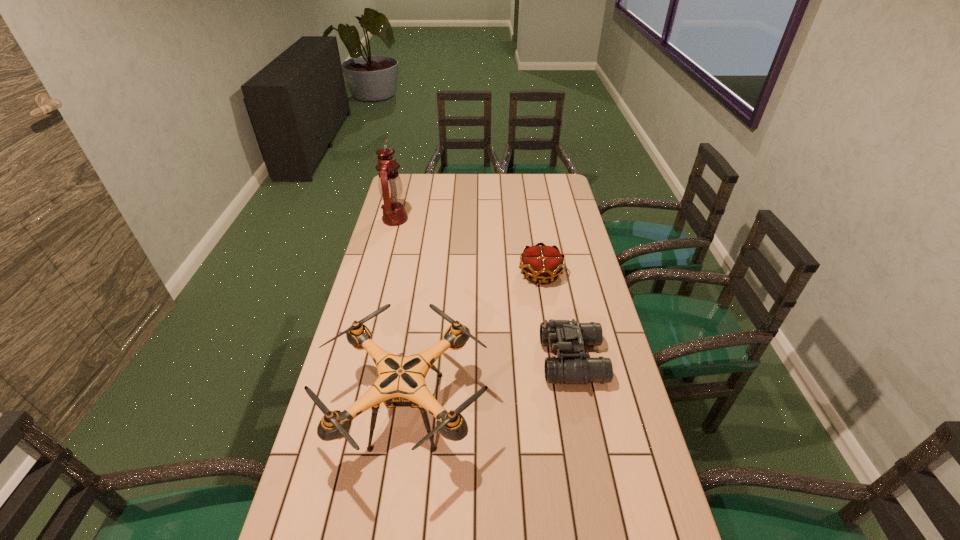
Locate an element on the screen. oil lamp is located at coordinates (390, 186).

The image size is (960, 540). What are the coordinates of `the farthest object` in the screenshot? It's located at (390, 186).

Locate an element on the screen. This screenshot has width=960, height=540. drone is located at coordinates 401,383.

Find the location of a particular element. This screenshot has height=540, width=960. the third tallest object is located at coordinates (571, 366).

This screenshot has width=960, height=540. What are the coordinates of `crown` in the screenshot? It's located at (543, 262).

What are the coordinates of `the second farthest object` in the screenshot? It's located at (543, 262).

The width and height of the screenshot is (960, 540). I want to click on free space located 0.320m on the back of the farthest object, so click(407, 175).

This screenshot has height=540, width=960. What are the coordinates of `vacant region located 0.060m on the camera mount of the drone` in the screenshot? It's located at (509, 410).

Image resolution: width=960 pixels, height=540 pixels. What are the coordinates of `vacant area situated 0.100m through the lenses of the second shortest object` in the screenshot? It's located at (510, 360).

I want to click on vacant space located through the lenses of the second shortest object, so click(526, 360).